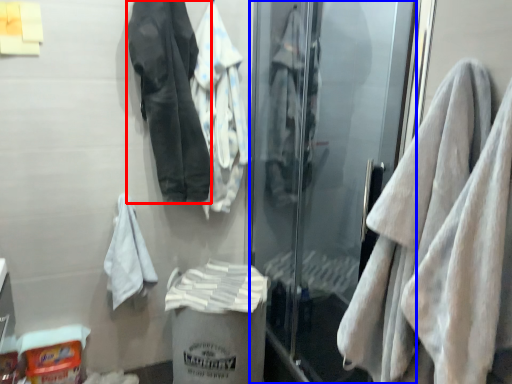
Question: Which point is further to the camera, jacket (highlighted by a red box) or screen door (highlighted by a blue box)?

Choices:
 (A) jacket
 (B) screen door

Answer: (A)